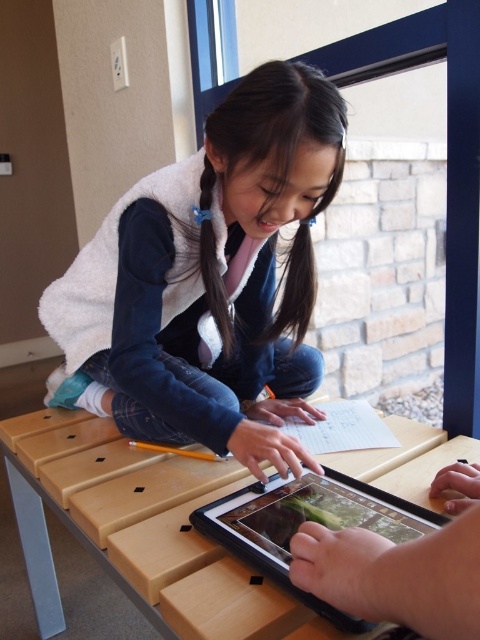
Question: Which of the following is the closest to the observer?

Choices:
 (A) black glossy tablet at lower center
 (B) white fleece vest at center
 (C) wooden table at center

Answer: (A)

Question: Which of the following is the closest to the observer?

Choices:
 (A) wooden table at center
 (B) white fleece vest at center
 (C) black glossy tablet at lower center

Answer: (C)

Question: Does white fleece vest at center appear under black glossy tablet at lower center?

Choices:
 (A) yes
 (B) no

Answer: (B)

Question: Can you confirm if wooden table at center is smaller than black glossy tablet at lower center?

Choices:
 (A) yes
 (B) no

Answer: (B)

Question: Where is white fleece vest at center located in relation to black glossy tablet at lower center in the image?

Choices:
 (A) above
 (B) below

Answer: (A)

Question: Which object is farther from the camera taking this photo?

Choices:
 (A) wooden table at center
 (B) black glossy tablet at lower center
 (C) white fleece vest at center

Answer: (C)